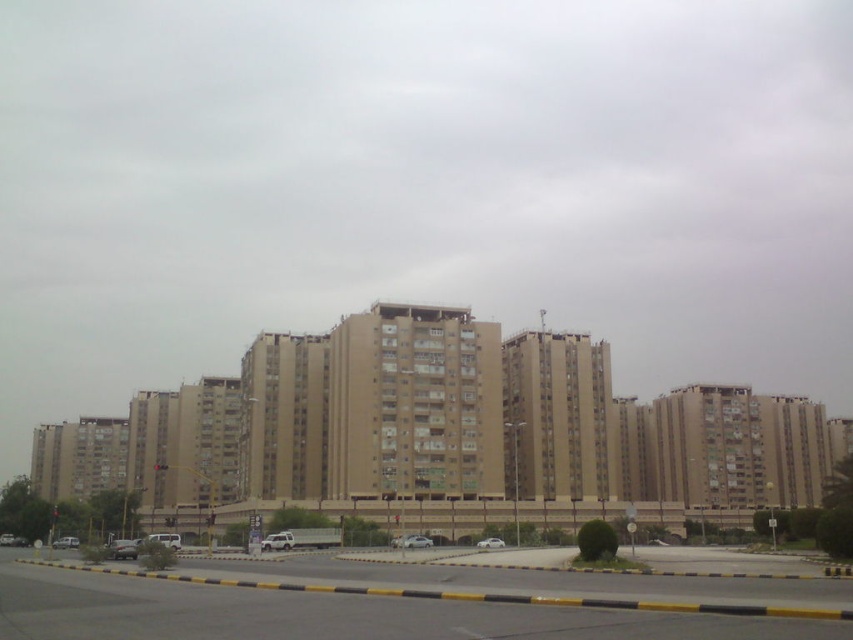
Does point (166, 541) come in front of point (659, 540)?

That is True.

The width and height of the screenshot is (853, 640). In order to click on silver metallic van at center in this screenshot , I will do `click(165, 540)`.

Between white matte truck at center and silver metallic van at lower left, which one appears on the right side from the viewer's perspective?

Positioned to the right is white matte truck at center.

Who is higher up, white matte truck at center or silver metallic van at lower left?

white matte truck at center is above.

Locate an element on the screen. This screenshot has height=640, width=853. white matte truck at center is located at coordinates (277, 541).

Which is more to the right, silver metallic car at center or white matte car at center?

From the viewer's perspective, white matte car at center appears more on the right side.

Who is lower down, silver metallic car at center or white matte car at center?

white matte car at center is below.

Between point (396, 547) and point (653, 544), which one is positioned behind?

Positioned behind is point (653, 544).

Locate an element on the screen. Image resolution: width=853 pixels, height=640 pixels. silver metallic car at center is located at coordinates (410, 541).